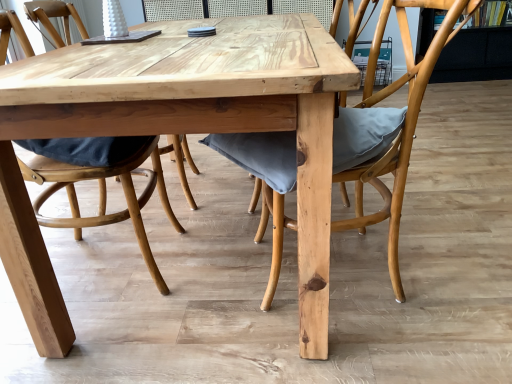
What are the coordinates of `vacant area that is situated to the right of matte wood chair at center, which is counted as the first chair, starting from the left` in the screenshot? It's located at (215, 258).